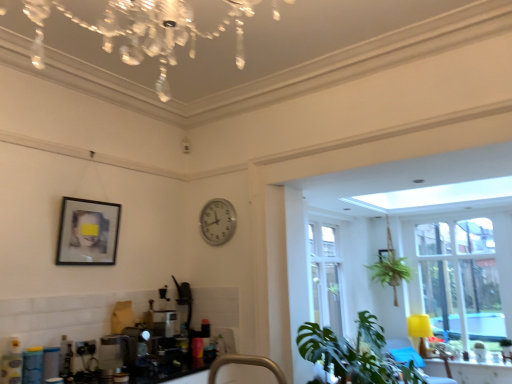
Question: Which is correct: crystal glass chandelier at upper center is inside yellow matte lamp at right, or outside of it?

Choices:
 (A) inside
 (B) outside

Answer: (B)

Question: Relative to yellow matte lamp at right, is crystal glass chandelier at upper center in front or behind?

Choices:
 (A) front
 (B) behind

Answer: (A)

Question: Based on their relative distances, which object is farther from the matte black picture frame at upper left, which is the 1th picture frame in front-to-back order?

Choices:
 (A) matte white window sill at lower right
 (B) satin silver toaster at lower left
 (C) velvet yellow armchair at lower right
 (D) green leafy plant at lower right
 (E) yellow matte lamp at right

Answer: (E)

Question: Based on their relative distances, which object is farther from the matte black picture frame at upper right, acting as the 2th picture frame starting from the top?

Choices:
 (A) clear glass window at right
 (B) green leafy plant at lower right
 (C) yellow matte lamp at right
 (D) brushed metal faucet at lower center
 (E) satin silver toaster at lower left

Answer: (D)